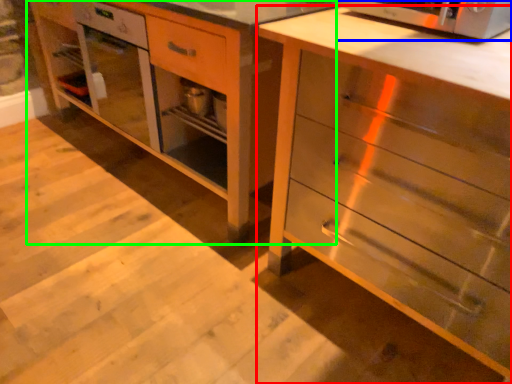
Question: Based on their relative distances, which object is nearer to chest of drawers (highlighted by a red box)? Choose from microwave oven (highlighted by a blue box) and vanity (highlighted by a green box).

Choices:
 (A) microwave oven
 (B) vanity

Answer: (A)